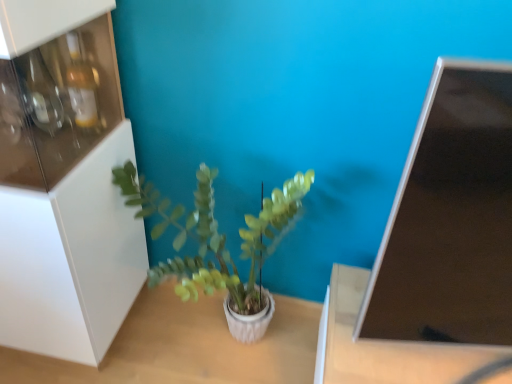
What are the coordinates of `white glossy cabinet at left` in the screenshot? It's located at (64, 182).

What do you see at coordinates (219, 244) in the screenshot?
I see `green matte plant at center` at bounding box center [219, 244].

This screenshot has width=512, height=384. Describe the element at coordinates (393, 347) in the screenshot. I see `brown matte table at lower right, which is the first table in right-to-left order` at that location.

Image resolution: width=512 pixels, height=384 pixels. What do you see at coordinates (450, 218) in the screenshot?
I see `matte black monitor at upper right` at bounding box center [450, 218].

This screenshot has height=384, width=512. What are the coordinates of `white glossy cabinet at left` in the screenshot? It's located at (64, 182).

Which object is positioned more to the left, green matte plant at center or brown matte table at lower right, which is the first table in right-to-left order?

green matte plant at center.

Can you see green matte plant at center touching brown matte table at lower right, which is the first table in right-to-left order?

No, green matte plant at center is not touching brown matte table at lower right, which is the first table in right-to-left order.

From a real-world perspective, who is located higher, green matte plant at center or brown matte table at lower right, which is the first table in right-to-left order?

green matte plant at center is physically above.

Locate an element on the screen. The width and height of the screenshot is (512, 384). houseplant on the left of brown matte table at lower right, which is the first table in right-to-left order is located at coordinates (219, 244).

Considering the sizes of objects white textured table at center, which ranks as the first table in left-to-right order, and white glossy cabinet at left in the image provided, who is taller, white textured table at center, which ranks as the first table in left-to-right order, or white glossy cabinet at left?

white glossy cabinet at left is taller.

Is white textured table at center, which is counted as the 2th table, starting from the right, facing towards white glossy cabinet at left?

No, white textured table at center, which is counted as the 2th table, starting from the right, is not facing towards white glossy cabinet at left.

Which point is more forward, (90, 375) or (69, 215)?

Positioned in front is point (69, 215).

Looking at the image, does white textured table at center, which ranks as the first table in left-to-right order, seem bigger or smaller compared to white glossy cabinet at left?

Clearly, white textured table at center, which ranks as the first table in left-to-right order, is smaller in size than white glossy cabinet at left.

Where is `computer monitor in front of the brown matte table at lower right, which is the first table in right-to-left order`? computer monitor in front of the brown matte table at lower right, which is the first table in right-to-left order is located at coordinates (450, 218).

Between matte black monitor at upper right and brown matte table at lower right, which is the first table in right-to-left order, which one is positioned behind?

Positioned behind is brown matte table at lower right, which is the first table in right-to-left order.

In the scene shown: From the image's perspective, is matte black monitor at upper right under brown matte table at lower right, which is the first table in right-to-left order?

No, from the image's perspective, matte black monitor at upper right is not below brown matte table at lower right, which is the first table in right-to-left order.

How distant is matte black monitor at upper right from brown matte table at lower right, which is the first table in right-to-left order?

A distance of 9.27 inches exists between matte black monitor at upper right and brown matte table at lower right, which is the first table in right-to-left order.

Can you confirm if white textured table at center, which ranks as the first table in left-to-right order, is smaller than green matte plant at center?

Yes.

Based on the photo, which object is further away from the camera taking this photo, white textured table at center, which is counted as the 2th table, starting from the right, or green matte plant at center?

white textured table at center, which is counted as the 2th table, starting from the right, is further from the camera.

From the image's perspective, is white textured table at center, which is counted as the 2th table, starting from the right, located beneath green matte plant at center?

Yes, from the image's perspective, white textured table at center, which is counted as the 2th table, starting from the right, is below green matte plant at center.

How different are the orientations of white textured table at center, which is counted as the 2th table, starting from the right, and green matte plant at center in degrees?

85.5 degrees.

How different are the orientations of green matte plant at center and white glossy cabinet at left in degrees?

3.21 degrees.

Is green matte plant at center oriented away from white glossy cabinet at left?

green matte plant at center does not have its back to white glossy cabinet at left.

Is green matte plant at center in contact with white glossy cabinet at left?

No, green matte plant at center is not making contact with white glossy cabinet at left.

From the image's perspective, is green matte plant at center positioned above or below white glossy cabinet at left?

Clearly, from the image's perspective, green matte plant at center is below white glossy cabinet at left.

You are a GUI agent. You are given a task and a screenshot of the screen. Output one action in this format:
    pyautogui.click(x=<x>, y=<y>)
    Task: Click on the shelf lying above the white textured table at center, which is counted as the 2th table, starting from the right (from the image's perspective)
    
    Given the screenshot: What is the action you would take?
    pyautogui.click(x=64, y=182)

From the image's perspective, is white glossy cabinet at left above white textured table at center, which is counted as the 2th table, starting from the right?

Correct, white glossy cabinet at left appears higher than white textured table at center, which is counted as the 2th table, starting from the right, in the image.

Based on the photo, considering the sizes of white glossy cabinet at left and white textured table at center, which is counted as the 2th table, starting from the right, in the image, is white glossy cabinet at left taller or shorter than white textured table at center, which is counted as the 2th table, starting from the right,?

In the image, white glossy cabinet at left appears to be taller than white textured table at center, which is counted as the 2th table, starting from the right.

Does white glossy cabinet at left lie behind white textured table at center, which ranks as the first table in left-to-right order?

That is False.

Who is bigger, green matte plant at center or white textured table at center, which ranks as the first table in left-to-right order?

Bigger between the two is green matte plant at center.

Which is less distant, (213,223) or (148,370)?

The point (213,223) is more forward.

Would you say green matte plant at center contains white textured table at center, which ranks as the first table in left-to-right order?

Actually, white textured table at center, which ranks as the first table in left-to-right order, is outside green matte plant at center.

Image resolution: width=512 pixels, height=384 pixels. Find the location of `houseplant behind the brown matte table at lower right, which is the first table in right-to-left order`. houseplant behind the brown matte table at lower right, which is the first table in right-to-left order is located at coordinates (219, 244).

The height and width of the screenshot is (384, 512). I want to click on the 2nd table below the white glossy cabinet at left (from the image's perspective), so click(x=186, y=347).

Considering their positions, is white glossy cabinet at left positioned closer to white textured table at center, which ranks as the first table in left-to-right order, than brown matte table at lower right, which is the first table in right-to-left order?

brown matte table at lower right, which is the first table in right-to-left order.

From the image, which object appears to be nearer to green matte plant at center, matte black monitor at upper right or white textured table at center, which is counted as the 2th table, starting from the right?

Based on the image, white textured table at center, which is counted as the 2th table, starting from the right, appears to be nearer to green matte plant at center.

Looking at the image, which one is located further to matte black monitor at upper right, green matte plant at center or white glossy cabinet at left?

The object further to matte black monitor at upper right is white glossy cabinet at left.

Considering their positions, is matte black monitor at upper right positioned further to white glossy cabinet at left than green matte plant at center?

matte black monitor at upper right is positioned further to the anchor white glossy cabinet at left.

Based on their spatial positions, is white textured table at center, which is counted as the 2th table, starting from the right, or matte black monitor at upper right closer to brown matte table at lower right, which is the first table in right-to-left order?

matte black monitor at upper right.

Which object lies further to the anchor point brown matte table at lower right, which is the first table in right-to-left order, green matte plant at center or white textured table at center, which is counted as the 2th table, starting from the right?

white textured table at center, which is counted as the 2th table, starting from the right, lies further to brown matte table at lower right, which is the first table in right-to-left order, than the other object.

In the scene shown: Estimate the real-world distances between objects in this image. Which object is further from white glossy cabinet at left, white textured table at center, which ranks as the first table in left-to-right order, or green matte plant at center?

white textured table at center, which ranks as the first table in left-to-right order, is positioned further to the anchor white glossy cabinet at left.

Looking at the image, which one is located closer to brown matte table at lower right, which is counted as the second table, starting from the left, matte black monitor at upper right or white glossy cabinet at left?

matte black monitor at upper right is positioned closer to the anchor brown matte table at lower right, which is counted as the second table, starting from the left.

The width and height of the screenshot is (512, 384). I want to click on table between white glossy cabinet at left and green matte plant at center in the horizontal direction, so click(186, 347).

Find the location of `houseplant between white glossy cabinet at left and matte black monitor at upper right from left to right`. houseplant between white glossy cabinet at left and matte black monitor at upper right from left to right is located at coordinates pos(219,244).

This screenshot has height=384, width=512. What are the coordinates of `houseplant between white textured table at center, which is counted as the 2th table, starting from the right, and matte black monitor at upper right from left to right` in the screenshot? It's located at (219, 244).

The image size is (512, 384). Find the location of `table between white glossy cabinet at left and brown matte table at lower right, which is counted as the second table, starting from the left, in the horizontal direction`. table between white glossy cabinet at left and brown matte table at lower right, which is counted as the second table, starting from the left, in the horizontal direction is located at coordinates (186, 347).